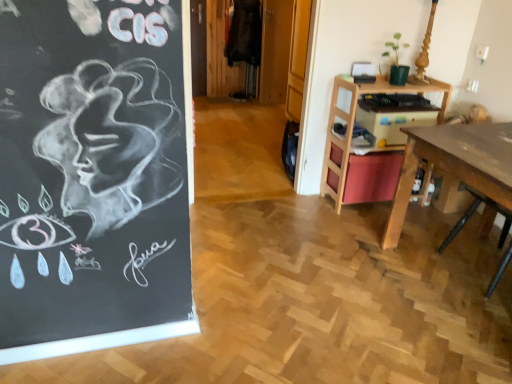
This screenshot has height=384, width=512. What are the coordinates of `unoccupied area in front of wooden desk at right` in the screenshot? It's located at (364, 229).